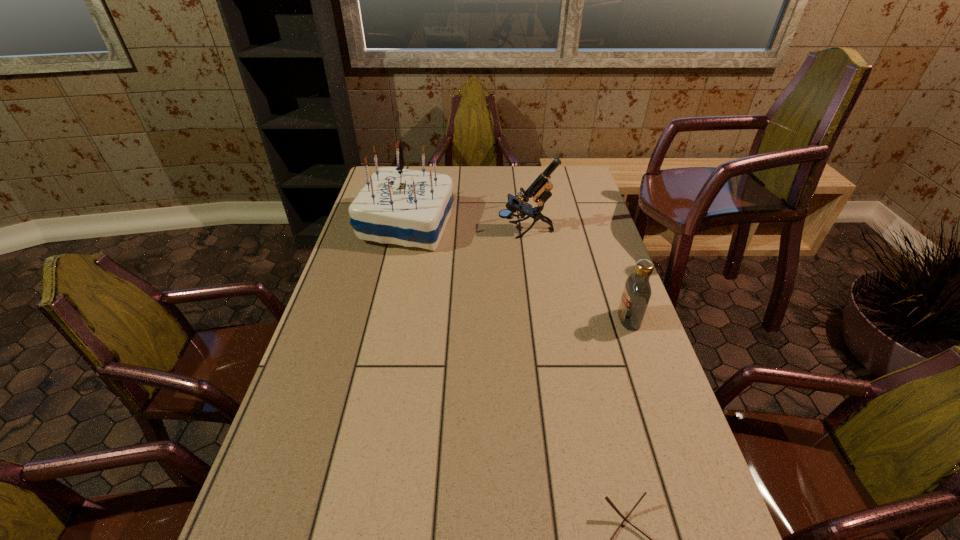
Where is `vacant point located on the front-facing side of the second shortest object`? This screenshot has width=960, height=540. vacant point located on the front-facing side of the second shortest object is located at coordinates (564, 319).

Where is `object that is at the left edge`? This screenshot has width=960, height=540. object that is at the left edge is located at coordinates (411, 208).

I want to click on object present at the right edge, so click(636, 295).

Identify the location of free spot at the far edge of the desktop. Image resolution: width=960 pixels, height=540 pixels. (455, 173).

In the image, there is a desktop. What are the coordinates of `vacant area at the left edge` in the screenshot? It's located at tap(347, 357).

Where is `free region at the right edge of the desktop`? The height and width of the screenshot is (540, 960). free region at the right edge of the desktop is located at coordinates click(569, 257).

The image size is (960, 540). I want to click on empty space between the second shortest object and the leftmost object, so click(x=517, y=272).

Find the location of a particular element. Image resolution: width=960 pixels, height=540 pixels. vacant area that lies between the microscope and the second shortest object is located at coordinates (577, 275).

I want to click on unoccupied area between the microscope and the birthday cake, so click(467, 227).

At what (x,y) coordinates should I click in order to perform the action: click on free point between the microscope and the vodka. Please return your answer as a coordinate pair (x, y). Looking at the image, I should click on (577, 275).